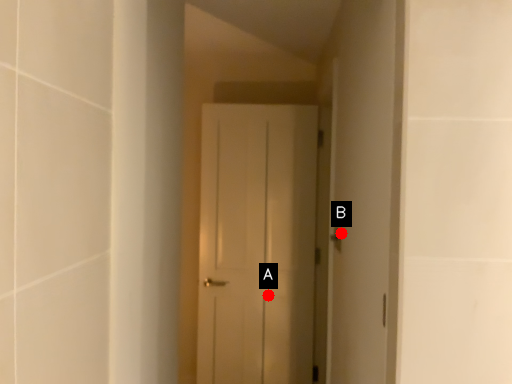
Question: Two points are circled on the image, labeled by A and B beside each circle. Which point is further to the camera?

Choices:
 (A) A is further
 (B) B is further

Answer: (A)